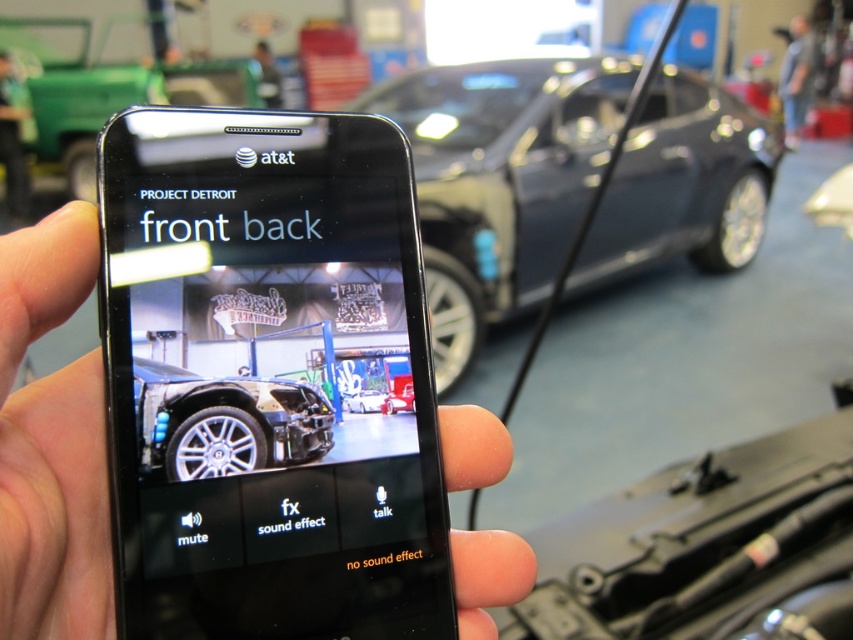
Who is taller, glossy metallic car at center or green fabric at upper left?

glossy metallic car at center

Is glossy metallic car at center above green fabric at upper left?

A: No.

Find the location of `glossy metallic car at center`. glossy metallic car at center is located at coordinates (500, 180).

Is gray fabric shirt at upper right thinner than green fabric at upper left?

Incorrect, gray fabric shirt at upper right's width is not less than green fabric at upper left's.

Is gray fabric shirt at upper right further to camera compared to green fabric at upper left?

Yes, it is behind green fabric at upper left.

Does point (814, 54) come farther from viewer compared to point (15, 161)?

Yes, it is behind point (15, 161).

The height and width of the screenshot is (640, 853). What are the coordinates of `gray fabric shirt at upper right` in the screenshot? It's located at (798, 77).

Is black matte phone at center bigger than green fabric at upper left?

Correct, black matte phone at center is larger in size than green fabric at upper left.

Does point (44, 442) come in front of point (6, 112)?

Yes, point (44, 442) is in front of point (6, 112).

The height and width of the screenshot is (640, 853). Find the location of `black matte phone at center`. black matte phone at center is located at coordinates (51, 442).